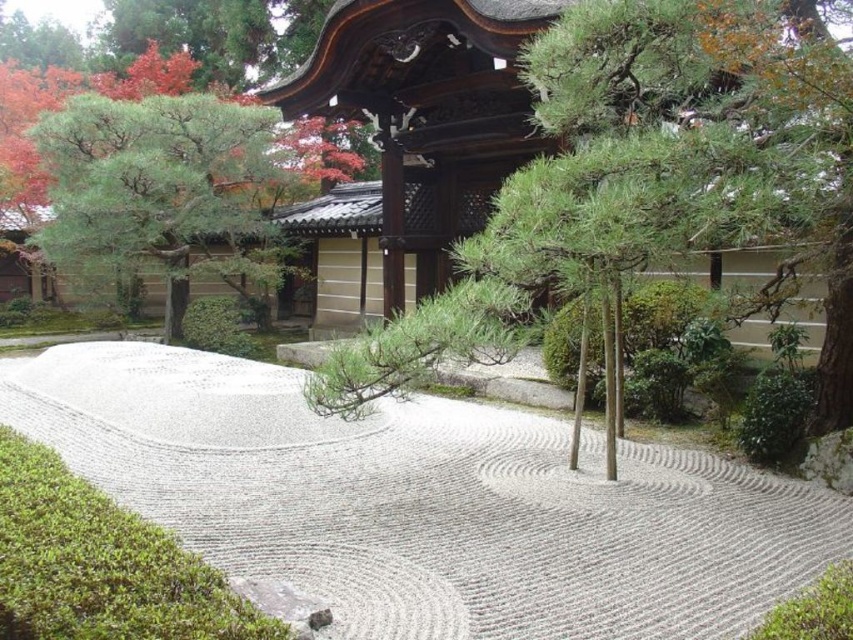
Question: Which point is closer to the camera?

Choices:
 (A) white gravel path at center
 (B) green textured pine tree at center

Answer: (A)

Question: Among these points, which one is nearest to the camera?

Choices:
 (A) (352, 358)
 (B) (172, 508)

Answer: (A)

Question: Which of the following is the farthest from the observer?

Choices:
 (A) white gravel path at center
 (B) green textured pine tree at center

Answer: (B)

Question: Does white gravel path at center have a larger size compared to green textured pine tree at center?

Choices:
 (A) no
 (B) yes

Answer: (B)

Question: Can you confirm if white gravel path at center is positioned above green textured pine tree at center?

Choices:
 (A) yes
 (B) no

Answer: (B)

Question: Where is white gravel path at center located in relation to green textured pine tree at center in the image?

Choices:
 (A) below
 (B) above

Answer: (A)